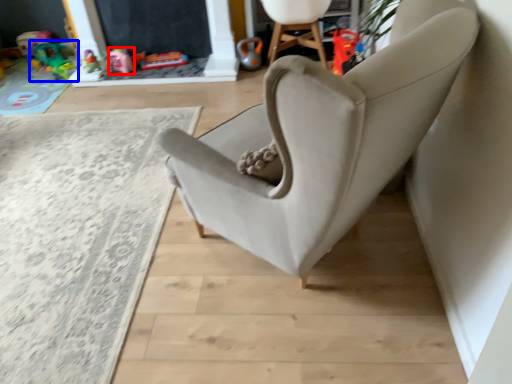
Question: Which point is further to the camera, toy (highlighted by a red box) or toy (highlighted by a blue box)?

Choices:
 (A) toy
 (B) toy

Answer: (B)